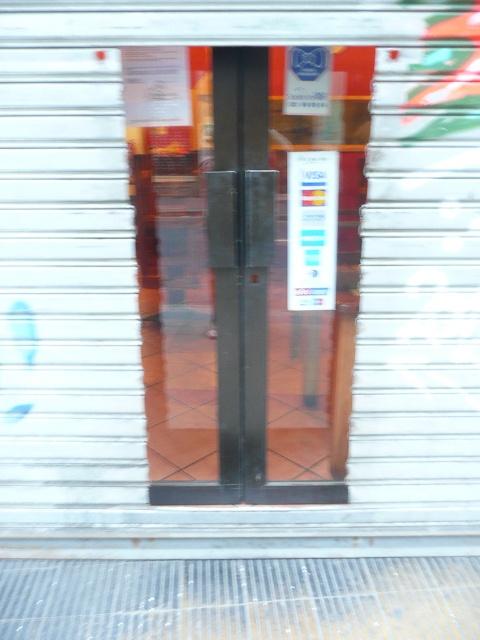
You are a delivery person trying to enter the store through the transparent glass door at center. There is a white paper at center blocking your view. Which object is larger in size so that you can decide if you can step over or move the obstruction?

The transparent glass door at center is bigger than the white paper at center, so the white paper at center is smaller and can be moved aside to access the door.

You are a delivery person approaching the storefront and need to enter through the doors. There is a specific point at coordinates point (255, 280) where you must deliver a package. Can you reach that point without passing through the security shutters?

The point (255, 280) is located at the transparent glass door at center, which is accessible through the partially open doors. Since the security shutters are partially closed but the doors are open, you can reach the point without passing through the shutters by entering through the open doors.

You are a delivery person with a cart that is 6 feet wide. You need to enter the store through the transparent glass door at center. Can your cart fit through the entrance?

The transparent glass door at center has an entrance width of 6.85 feet, which is wider than your cart that is 6 feet wide. Therefore, your cart can fit through the entrance.